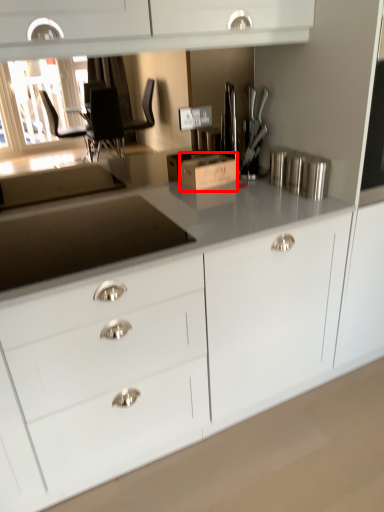
Question: Where is cardboard box (annotated by the red box) located in relation to appliance in the image?

Choices:
 (A) left
 (B) right

Answer: (A)